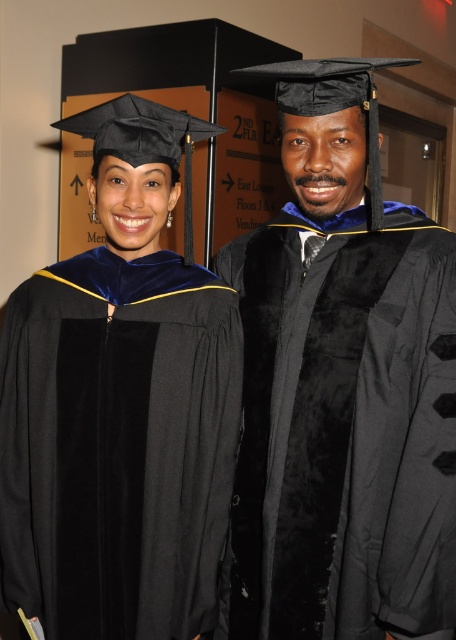
Question: Which point is closer to the camera?

Choices:
 (A) black matte graduation gown at center
 (B) velvet black gown at center

Answer: (A)

Question: Does black matte graduation gown at center have a lesser width compared to velvet black gown at center?

Choices:
 (A) yes
 (B) no

Answer: (A)

Question: Is black matte graduation gown at center to the right of velvet black gown at center from the viewer's perspective?

Choices:
 (A) yes
 (B) no

Answer: (A)

Question: Where is black matte graduation gown at center located in relation to velvet black gown at center in the image?

Choices:
 (A) below
 (B) above

Answer: (B)

Question: Which point appears closest to the camera in this image?

Choices:
 (A) (332, 328)
 (B) (71, 545)

Answer: (A)